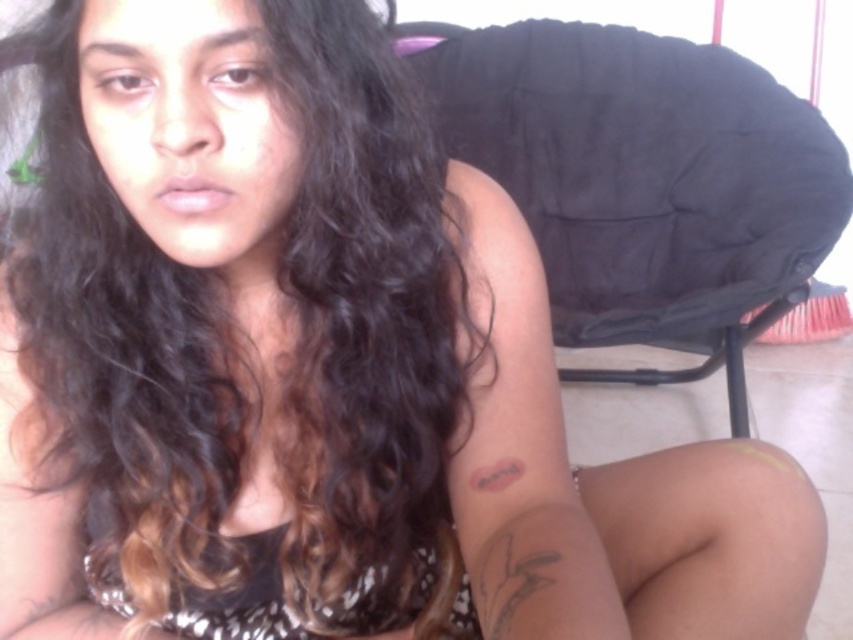
Is black fabric chair at upper right smaller than black sequined bikini top at lower left?

No.

Is black fabric chair at upper right further to the viewer compared to black sequined bikini top at lower left?

Yes, it is.

This screenshot has width=853, height=640. Identify the location of black fabric chair at upper right. (642, 180).

At what (x,y) coordinates should I click in order to perform the action: click on black fabric chair at upper right. Please return your answer as a coordinate pair (x, y). Looking at the image, I should click on (642, 180).

Is black sequined bikini top at lower left in front of black ink tattoo at upper arm?

No, it is not.

Which is below, black sequined bikini top at lower left or black ink tattoo at upper arm?

black sequined bikini top at lower left is lower down.

In order to click on black sequined bikini top at lower left in this screenshot , I will do tap(289, 608).

Is black fabric chair at upper right thinner than black ink tattoo at upper arm?

In fact, black fabric chair at upper right might be wider than black ink tattoo at upper arm.

Is black fabric chair at upper right positioned before black ink tattoo at upper arm?

That is False.

Between point (801, 256) and point (498, 460), which one is positioned in front?

Point (498, 460) is in front.

Where is `black fabric chair at upper right`? The height and width of the screenshot is (640, 853). black fabric chair at upper right is located at coordinates (642, 180).